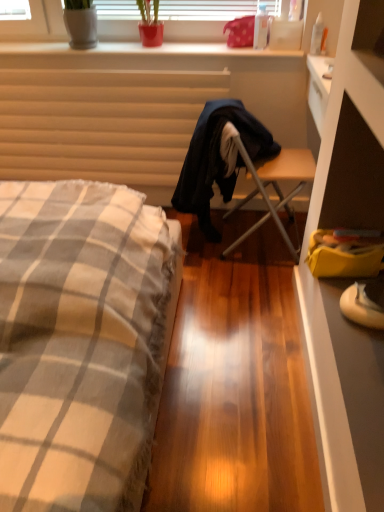
Locate an element on the screen. This screenshot has width=384, height=512. free space in front of wooden folding chair at center is located at coordinates (246, 292).